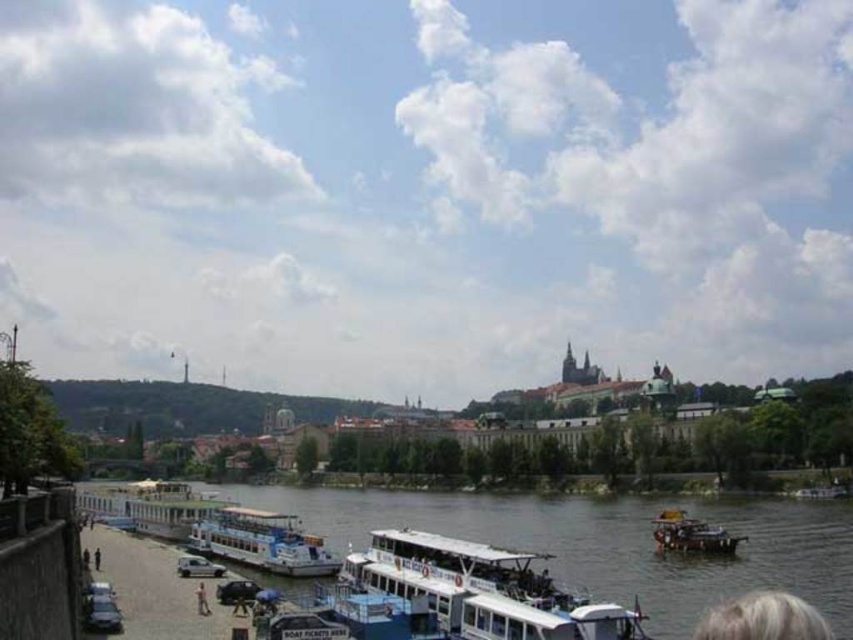
You are a photographer standing on the riverside walkway and want to capture a photo of the white smooth water at lower center and the white plastic boat at center. Based on their positions, which object should you frame first in your camera viewfinder to ensure both are included in the shot?

The white smooth water at lower center should be framed first since it is positioned on the left side of the white plastic boat at center, so starting with the left side ensures both objects are included in the shot.

You are standing at the lower left corner of the image. You want to walk towards the white fabric umbrella at lower center. In which general direction should you move?

Since the white fabric umbrella at lower center is located at point (x=201, y=600), you should move towards the right to reach it from the lower left corner.

You are a photographer planning to take a photo of the white plastic boat at center and the white plastic boat at lower center. Which boat should you focus on if you want to capture the one that appears larger in the frame?

The white plastic boat at center might be wider than white plastic boat at lower center, so focusing on it would likely result in a larger appearance in the photo.